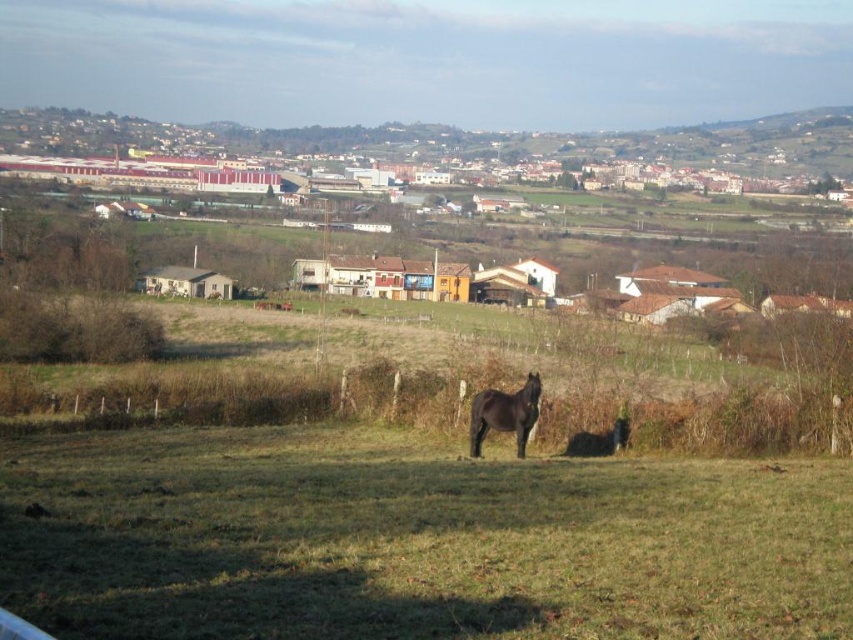
How distant is green grassy field at center from black glossy horse at center?

green grassy field at center and black glossy horse at center are 4.98 meters apart.

Who is positioned more to the left, green grassy field at center or black glossy horse at center?

From the viewer's perspective, green grassy field at center appears more on the left side.

Does point (306, 618) come closer to viewer compared to point (534, 403)?

Yes, it is.

Where is `green grassy field at center`? green grassy field at center is located at coordinates (413, 540).